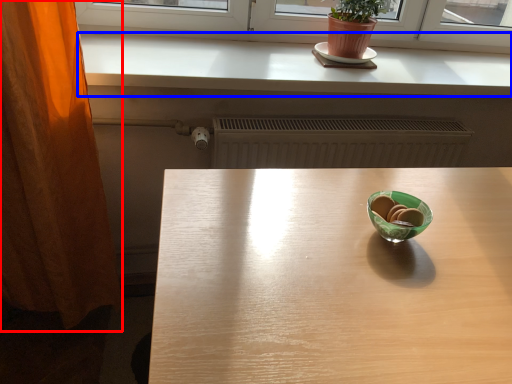
Question: Which of the following is the farthest to the observer, curtain (highlighted by a red box) or counter top (highlighted by a blue box)?

Choices:
 (A) curtain
 (B) counter top

Answer: (B)